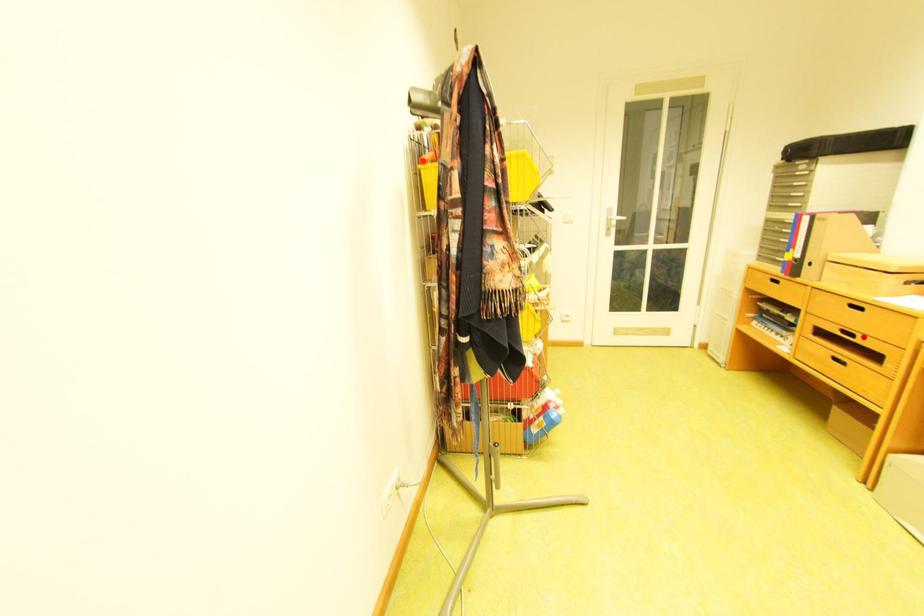
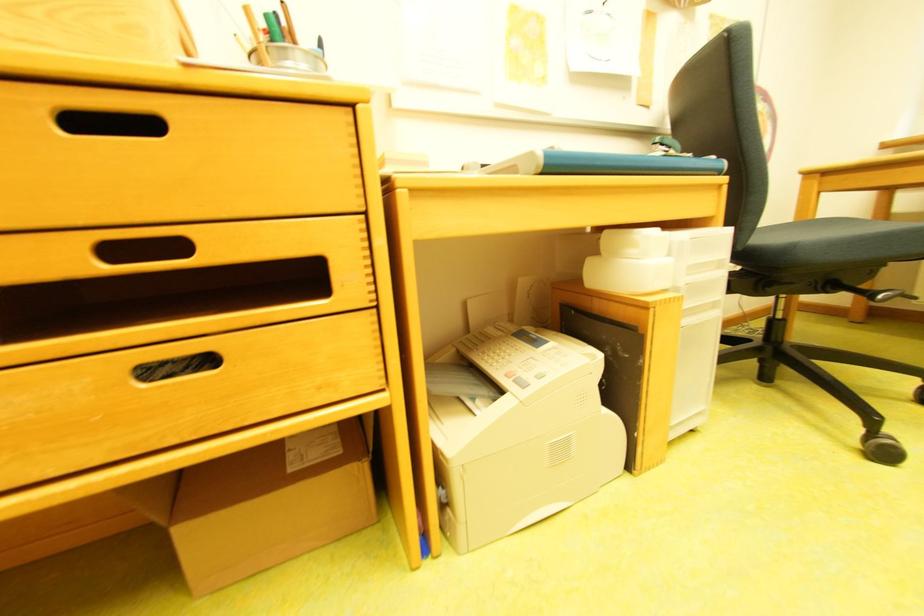
Question: I am providing you with two images of the same scene from different viewpoints. Given a red point in image1, look at the same physical point in image2. Is it:

Choices:
 (A) Closer to the viewpoint
 (B) Farther from the viewpoint

Answer: (A)